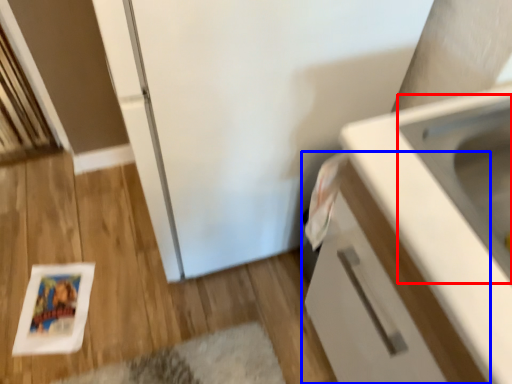
Question: Which object appears farthest to the camera in this image, sink (highlighted by a red box) or cabinetry (highlighted by a blue box)?

Choices:
 (A) sink
 (B) cabinetry

Answer: (A)